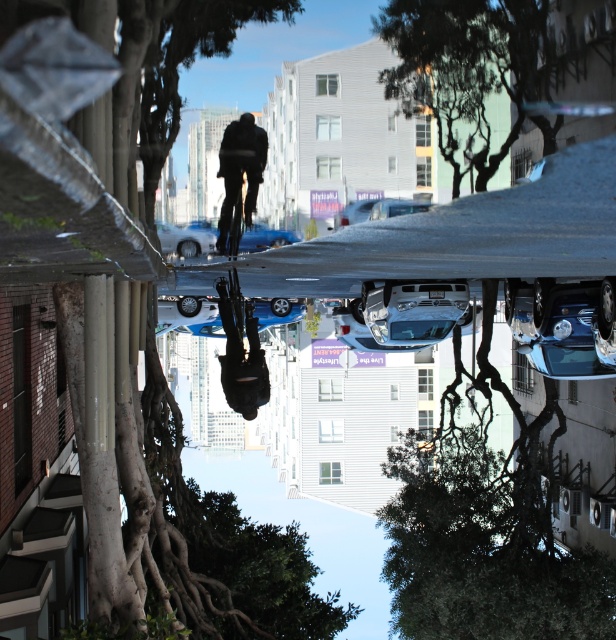
You are a delivery person who needs to park your black matte bicycle at center. The parking area is located at point 0.5, 0.5. Is the bicycle currently positioned closer to the parking area than to the tree on the left?

The black matte bicycle at center is located at point [240,170]. The parking area is at [308,320]. Calculating the distance between these points, the bicycle is closer to the parking area than to the tree on the left.